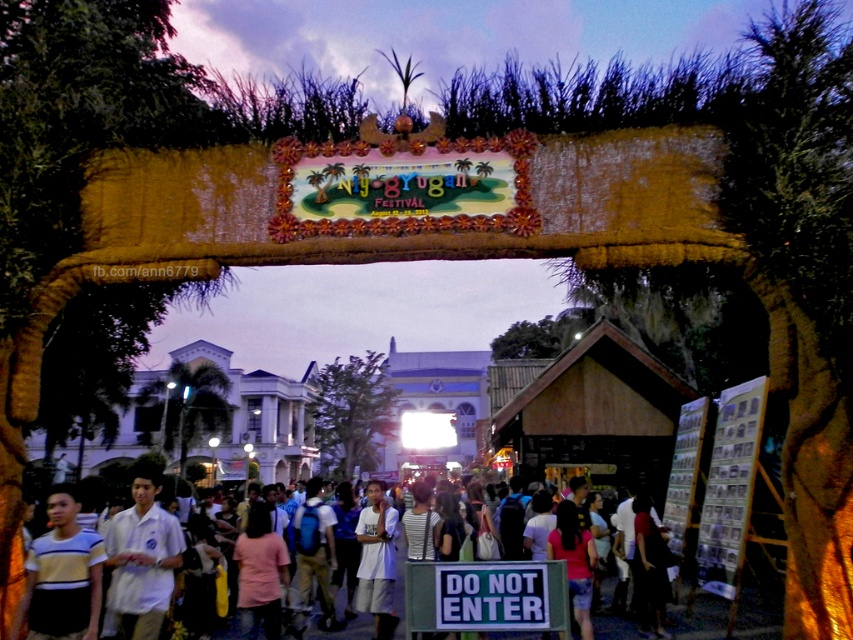
Is striped jersey at center smaller than white matte shirt at center?

No, striped jersey at center is not smaller than white matte shirt at center.

Between striped jersey at center and white matte shirt at center, which one is positioned higher?

Positioned higher is striped jersey at center.

Is point (90, 630) farther from camera compared to point (368, 548)?

No, it is not.

Where is `striped jersey at center`? This screenshot has width=853, height=640. striped jersey at center is located at coordinates (62, 576).

Describe the element at coordinates (142, 556) in the screenshot. The width and height of the screenshot is (853, 640). I see `white matte shirt at lower left` at that location.

Who is more forward, (x=148, y=556) or (x=582, y=618)?

Point (x=148, y=556) is more forward.

This screenshot has width=853, height=640. Find the location of `white matte shirt at lower left`. white matte shirt at lower left is located at coordinates pyautogui.click(x=142, y=556).

Which is more to the right, white matte shirt at lower left or white matte shirt at center?

white matte shirt at center is more to the right.

Does white matte shirt at lower left have a larger size compared to white matte shirt at center?

Yes.

Locate an element on the screen. This screenshot has width=853, height=640. white matte shirt at lower left is located at coordinates (142, 556).